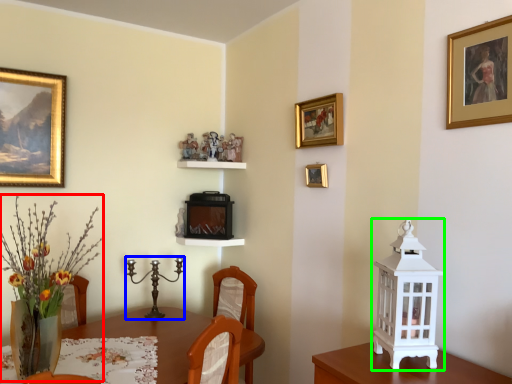
Question: Which object is the farthest from floral arrangement (highlighted by a red box)? Choose among these: candle holder (highlighted by a blue box) or candle holder (highlighted by a green box).

Choices:
 (A) candle holder
 (B) candle holder

Answer: (B)